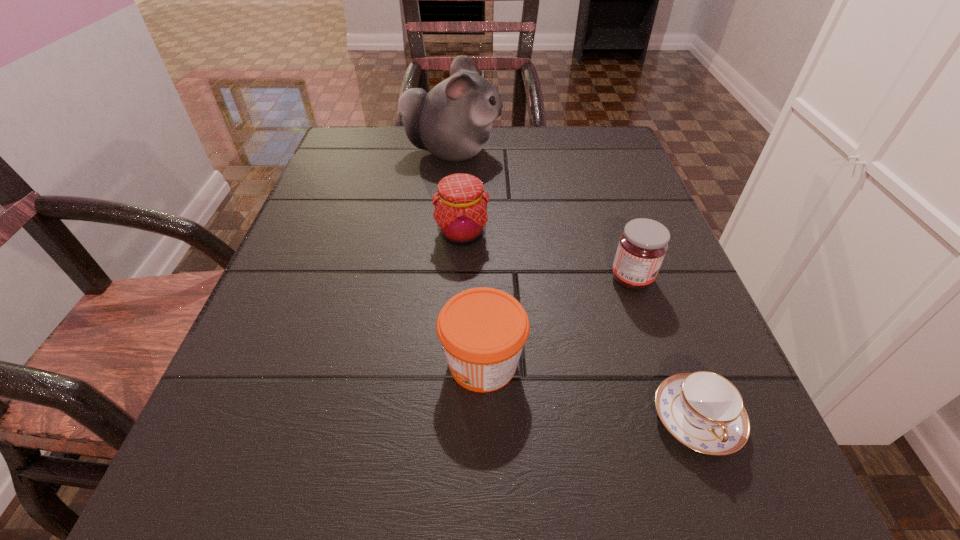
At what (x,y) coordinates should I click in order to perform the action: click on free space at the far left corner of the desktop. Please return your answer as a coordinate pair (x, y). This screenshot has width=960, height=540. Looking at the image, I should click on (401, 147).

Locate an element on the screen. This screenshot has height=540, width=960. vacant space at the near left corner is located at coordinates (222, 532).

You are a GUI agent. You are given a task and a screenshot of the screen. Output one action in this format:
    pyautogui.click(x=<x>, y=<y>)
    Task: Click on the vacant space at the far right corner of the desktop
    
    Given the screenshot: What is the action you would take?
    pyautogui.click(x=596, y=131)

Identify the location of vacant region between the shortest object and the hamster. This screenshot has width=960, height=540. (574, 286).

At what (x,y) coordinates should I click in order to perform the action: click on empty space that is in between the nearest jam and the farthest object. Please return your answer as a coordinate pair (x, y). Looking at the image, I should click on (468, 258).

At what (x,y) coordinates should I click in order to perform the action: click on vacant area that lies between the teacup and the nearest jam. Please return your answer as a coordinate pair (x, y). This screenshot has width=960, height=540. Looking at the image, I should click on (589, 391).

Find the location of a particular element. free spot between the hamster and the nearest jam is located at coordinates (468, 258).

Where is `empty location between the farthest jam and the rightmost jam`? Image resolution: width=960 pixels, height=540 pixels. empty location between the farthest jam and the rightmost jam is located at coordinates (547, 256).

At what (x,y) coordinates should I click in order to perform the action: click on vacant area between the rightmost jam and the farthest jam. Please return your answer as a coordinate pair (x, y). Image resolution: width=960 pixels, height=540 pixels. Looking at the image, I should click on (547, 256).

The height and width of the screenshot is (540, 960). What are the coordinates of `free area in between the nearest jam and the hamster` in the screenshot? It's located at (468, 258).